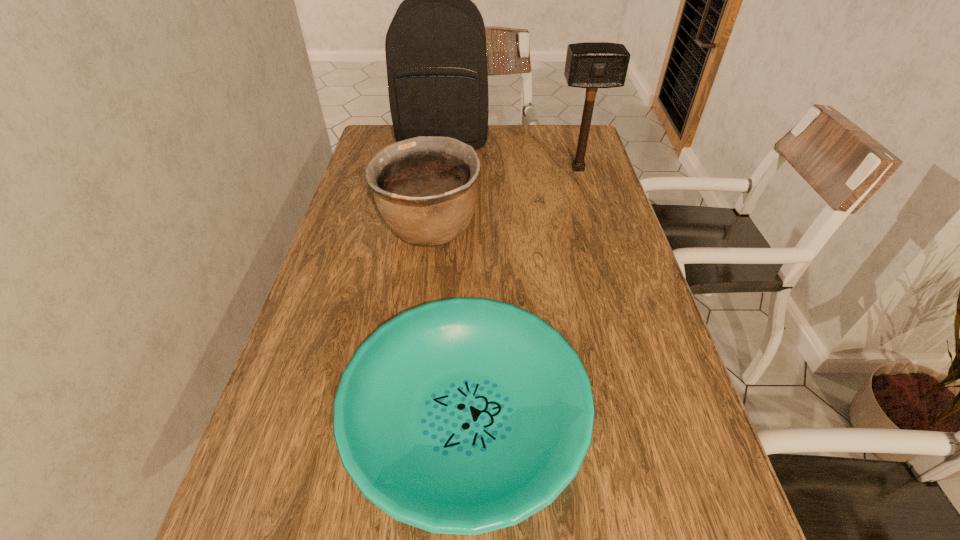
The width and height of the screenshot is (960, 540). Find the location of `the farthest object`. the farthest object is located at coordinates (436, 58).

Where is `the tallest object`? The image size is (960, 540). the tallest object is located at coordinates (436, 58).

Locate an element on the screen. This screenshot has height=540, width=960. the second tallest object is located at coordinates (591, 65).

You are a GUI agent. You are given a task and a screenshot of the screen. Output one action in this format:
    pyautogui.click(x=<x>, y=<y>)
    Task: Click on the rightmost object
    
    Given the screenshot: What is the action you would take?
    pyautogui.click(x=591, y=65)

Find the location of a particular element. This screenshot has height=540, width=960. the third farthest object is located at coordinates (425, 188).

What are the coordinates of `pottery` in the screenshot? It's located at (425, 188).

The height and width of the screenshot is (540, 960). I want to click on vacant space situated 0.390m on the front-facing side of the farthest object, so click(432, 235).

At what (x,y) coordinates should I click in order to perform the action: click on free region located 0.120m on the left of the second tallest object. Please return your answer as a coordinate pair (x, y). Image resolution: width=960 pixels, height=540 pixels. Looking at the image, I should click on (516, 168).

Image resolution: width=960 pixels, height=540 pixels. In order to click on free space located on the back of the second nearest object in this screenshot , I will do `click(440, 148)`.

At what (x,y) coordinates should I click in order to perform the action: click on object at the far edge. Please return your answer as a coordinate pair (x, y). This screenshot has height=540, width=960. Looking at the image, I should click on (436, 58).